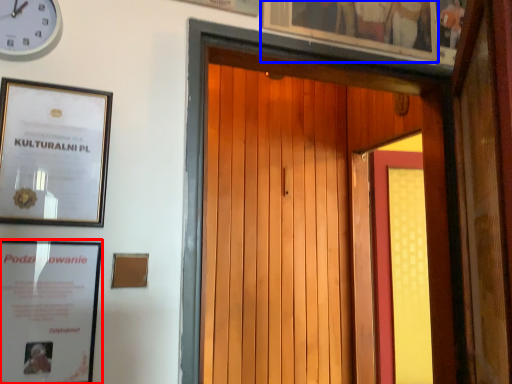
Question: Which of the following is the farthest to the observer, picture frame (highlighted by a red box) or picture frame (highlighted by a blue box)?

Choices:
 (A) picture frame
 (B) picture frame

Answer: (B)